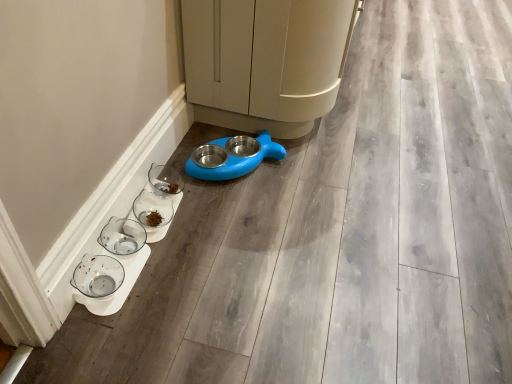
At what (x,y) coordinates should I click in order to perform the action: click on transparent glass bowl at lower left, the third glass bowl when ordered from back to front. Please return your answer as a coordinate pair (x, y). Looking at the image, I should click on (98, 276).

What is the approximate height of clear glass bowl at lower left, the 2th glass bowl in the front-to-back sequence?

It is 10.70 centimeters.

Identify the location of clear glass bowl at lower center, the 3th glass bowl in the front-to-back sequence. The width and height of the screenshot is (512, 384). pyautogui.click(x=152, y=210).

Is transparent glass bowl at lower left, the third glass bowl when ordered from back to front, at the left side of blue plastic bowl at lower center?

Answer: Yes.

Which is correct: transparent glass bowl at lower left, the third glass bowl when ordered from back to front, is inside blue plastic bowl at lower center, or outside of it?

transparent glass bowl at lower left, the third glass bowl when ordered from back to front, is not enclosed by blue plastic bowl at lower center.

Between point (122, 275) and point (258, 123), which one is positioned in front?

The point (122, 275) is closer.

From the image's perspective, which is above, transparent glass bowl at lower left, which is counted as the first glass bowl, starting from the front, or blue plastic bowl at lower center?

blue plastic bowl at lower center is shown above in the image.

Is blue plastic pet feeder at center next to clear glass bowl at lower left, the 2th glass bowl viewed from the back?

blue plastic pet feeder at center is not next to clear glass bowl at lower left, the 2th glass bowl viewed from the back, and they're not touching.

Find the location of a particular element. This screenshot has width=512, height=384. appliance above the clear glass bowl at lower left, the 2th glass bowl viewed from the back (from the image's perspective) is located at coordinates pyautogui.click(x=238, y=162).

Between blue plastic pet feeder at center and clear glass bowl at lower left, the 2th glass bowl in the front-to-back sequence, which one has larger size?

blue plastic pet feeder at center is bigger.

Does blue plastic bowl at lower center have a greater height compared to blue plastic pet feeder at center?

Correct, blue plastic bowl at lower center is much taller as blue plastic pet feeder at center.

Based on their positions, is blue plastic bowl at lower center located to the left or right of blue plastic pet feeder at center?

blue plastic bowl at lower center is positioned on blue plastic pet feeder at center's right side.

Which point is more distant from viewer, (309, 127) or (223, 176)?

The point (309, 127) is behind.

In the image, is blue plastic bowl at lower center positioned in front of or behind blue plastic pet feeder at center?

blue plastic bowl at lower center is in front of blue plastic pet feeder at center.

Considering the sizes of clear glass bowl at lower left, the 2th glass bowl in the front-to-back sequence, and blue plastic pet feeder at center in the image, is clear glass bowl at lower left, the 2th glass bowl in the front-to-back sequence, taller or shorter than blue plastic pet feeder at center?

In the image, clear glass bowl at lower left, the 2th glass bowl in the front-to-back sequence, appears to be taller than blue plastic pet feeder at center.

Considering the positions of objects clear glass bowl at lower left, the 2th glass bowl viewed from the back, and blue plastic pet feeder at center in the image provided, who is in front, clear glass bowl at lower left, the 2th glass bowl viewed from the back, or blue plastic pet feeder at center?

clear glass bowl at lower left, the 2th glass bowl viewed from the back, is more forward.

Is clear glass bowl at lower left, the 2th glass bowl viewed from the back, to the left or to the right of blue plastic pet feeder at center in the image?

Based on their positions, clear glass bowl at lower left, the 2th glass bowl viewed from the back, is located to the left of blue plastic pet feeder at center.

From the image's perspective, is clear glass bowl at lower left, the 2th glass bowl viewed from the back, under blue plastic pet feeder at center?

Correct, clear glass bowl at lower left, the 2th glass bowl viewed from the back, appears lower than blue plastic pet feeder at center in the image.

Does blue plastic pet feeder at center have a greater height compared to clear glass bowl at lower center, which is the first glass bowl in back-to-front order?

Yes.

Which is less distant, (x=189, y=161) or (x=160, y=221)?

Point (x=189, y=161) is farther from the camera than point (x=160, y=221).

Is blue plastic pet feeder at center bigger or smaller than clear glass bowl at lower center, the 3th glass bowl in the front-to-back sequence?

Clearly, blue plastic pet feeder at center is larger in size than clear glass bowl at lower center, the 3th glass bowl in the front-to-back sequence.

Would you say blue plastic pet feeder at center is inside or outside clear glass bowl at lower center, the 3th glass bowl in the front-to-back sequence?

blue plastic pet feeder at center lies outside clear glass bowl at lower center, the 3th glass bowl in the front-to-back sequence.

From a real-world perspective, is blue plastic pet feeder at center over blue plastic bowl at lower center?

Incorrect, from a real-world perspective, blue plastic pet feeder at center is lower than blue plastic bowl at lower center.

Does blue plastic pet feeder at center have a greater width compared to blue plastic bowl at lower center?

Incorrect, the width of blue plastic pet feeder at center does not surpass that of blue plastic bowl at lower center.

Can you tell me how much blue plastic pet feeder at center and blue plastic bowl at lower center differ in facing direction?

blue plastic pet feeder at center and blue plastic bowl at lower center are facing 41 degrees away from each other.

Measure the distance between blue plastic pet feeder at center and blue plastic bowl at lower center.

The distance of blue plastic pet feeder at center from blue plastic bowl at lower center is 11.54 inches.

Does transparent glass bowl at lower left, which is counted as the first glass bowl, starting from the front, come in front of blue plastic pet feeder at center?

Yes.

Can you see transparent glass bowl at lower left, the third glass bowl when ordered from back to front, touching blue plastic pet feeder at center?

No, transparent glass bowl at lower left, the third glass bowl when ordered from back to front, is not next to blue plastic pet feeder at center.

Which of these two, transparent glass bowl at lower left, the third glass bowl when ordered from back to front, or blue plastic pet feeder at center, is thinner?

Thinner between the two is transparent glass bowl at lower left, the third glass bowl when ordered from back to front.

Looking at this image, would you say transparent glass bowl at lower left, the third glass bowl when ordered from back to front, is to the left or to the right of blue plastic pet feeder at center in the picture?

Based on their positions, transparent glass bowl at lower left, the third glass bowl when ordered from back to front, is located to the left of blue plastic pet feeder at center.

There is a blue plastic bowl at lower center. At what (x,y) coordinates should I click in order to perform the action: click on the 3rd glass bowl below it (from the image's perspective). Please return your answer as a coordinate pair (x, y). Image resolution: width=512 pixels, height=384 pixels. Looking at the image, I should click on (98, 276).

Locate an element on the screen. This screenshot has width=512, height=384. the 3rd glass bowl directly above the blue plastic pet feeder at center (from a real-world perspective) is located at coordinates (123, 238).

Estimate the real-world distances between objects in this image. Which object is further from blue plastic pet feeder at center, blue plastic bowl at lower center or clear glass bowl at lower center, the 3th glass bowl in the front-to-back sequence?

blue plastic bowl at lower center is further to blue plastic pet feeder at center.

From the image, which object appears to be nearer to blue plastic pet feeder at center, transparent glass bowl at lower left, the third glass bowl when ordered from back to front, or clear glass bowl at lower center, the 3th glass bowl in the front-to-back sequence?

clear glass bowl at lower center, the 3th glass bowl in the front-to-back sequence, is closer to blue plastic pet feeder at center.

From the image, which object appears to be nearer to blue plastic bowl at lower center, transparent glass bowl at lower left, which is counted as the first glass bowl, starting from the front, or blue plastic pet feeder at center?

blue plastic pet feeder at center lies closer to blue plastic bowl at lower center than the other object.

Which object lies nearer to the anchor point clear glass bowl at lower center, which is the first glass bowl in back-to-front order, clear glass bowl at lower left, the 2th glass bowl viewed from the back, or blue plastic pet feeder at center?

Based on the image, clear glass bowl at lower left, the 2th glass bowl viewed from the back, appears to be nearer to clear glass bowl at lower center, which is the first glass bowl in back-to-front order.

Looking at the image, which one is located further to clear glass bowl at lower left, the 2th glass bowl in the front-to-back sequence, blue plastic bowl at lower center or clear glass bowl at lower center, which is the first glass bowl in back-to-front order?

blue plastic bowl at lower center.

Looking at the image, which one is located closer to transparent glass bowl at lower left, the third glass bowl when ordered from back to front, clear glass bowl at lower left, the 2th glass bowl in the front-to-back sequence, or blue plastic pet feeder at center?

Among the two, clear glass bowl at lower left, the 2th glass bowl in the front-to-back sequence, is located nearer to transparent glass bowl at lower left, the third glass bowl when ordered from back to front.

Estimate the real-world distances between objects in this image. Which object is further from clear glass bowl at lower left, the 2th glass bowl viewed from the back, blue plastic bowl at lower center or transparent glass bowl at lower left, the third glass bowl when ordered from back to front?

Among the two, blue plastic bowl at lower center is located further to clear glass bowl at lower left, the 2th glass bowl viewed from the back.

Which object lies further to the anchor point clear glass bowl at lower left, the 2th glass bowl in the front-to-back sequence, transparent glass bowl at lower left, the third glass bowl when ordered from back to front, or blue plastic pet feeder at center?

Based on the image, blue plastic pet feeder at center appears to be further to clear glass bowl at lower left, the 2th glass bowl in the front-to-back sequence.

The image size is (512, 384). In order to click on appliance between blue plastic bowl at lower center and clear glass bowl at lower center, which is the first glass bowl in back-to-front order, in the vertical direction in this screenshot , I will do `click(238, 162)`.

Identify the location of glass bowl located between clear glass bowl at lower left, the 2th glass bowl in the front-to-back sequence, and blue plastic pet feeder at center in the left-right direction. The height and width of the screenshot is (384, 512). (152, 210).

Identify the location of glass bowl between transparent glass bowl at lower left, the third glass bowl when ordered from back to front, and clear glass bowl at lower center, the 3th glass bowl in the front-to-back sequence, from front to back. (123, 238).

Where is `appliance between blue plastic bowl at lower center and transparent glass bowl at lower left, the third glass bowl when ordered from back to front, in the vertical direction`? The image size is (512, 384). appliance between blue plastic bowl at lower center and transparent glass bowl at lower left, the third glass bowl when ordered from back to front, in the vertical direction is located at coordinates (238, 162).